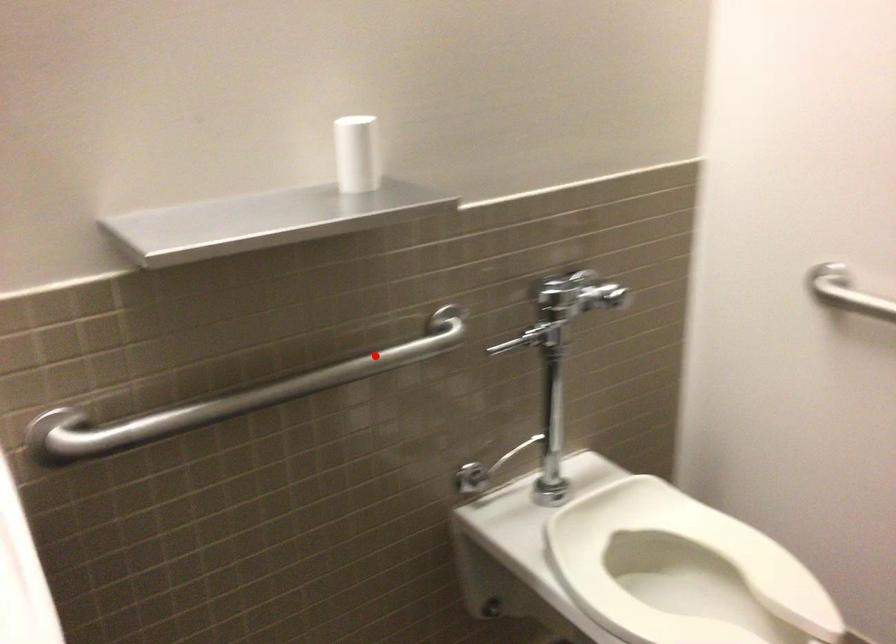
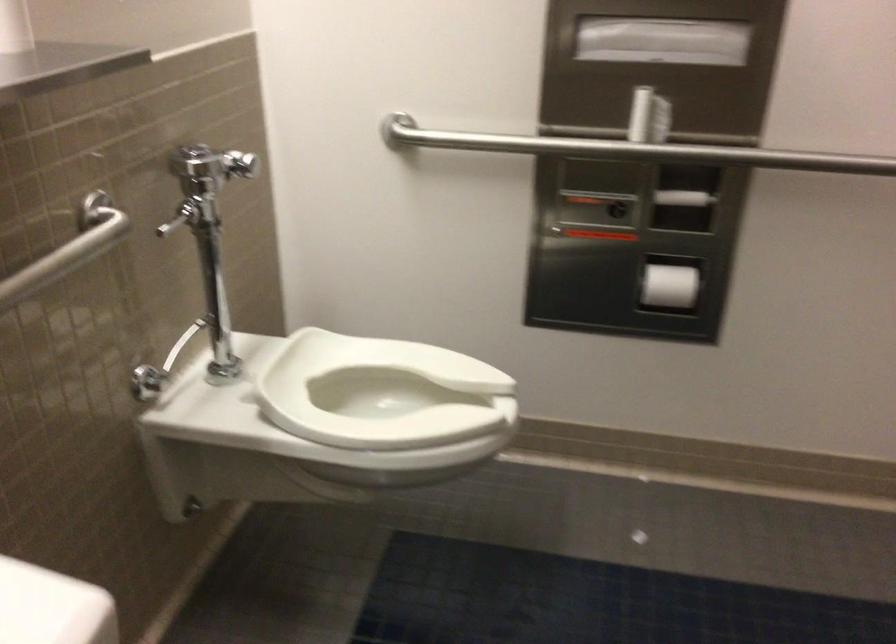
The point at the highlighted location is marked in the first image. Where is the corresponding point in the second image?

(67, 250)